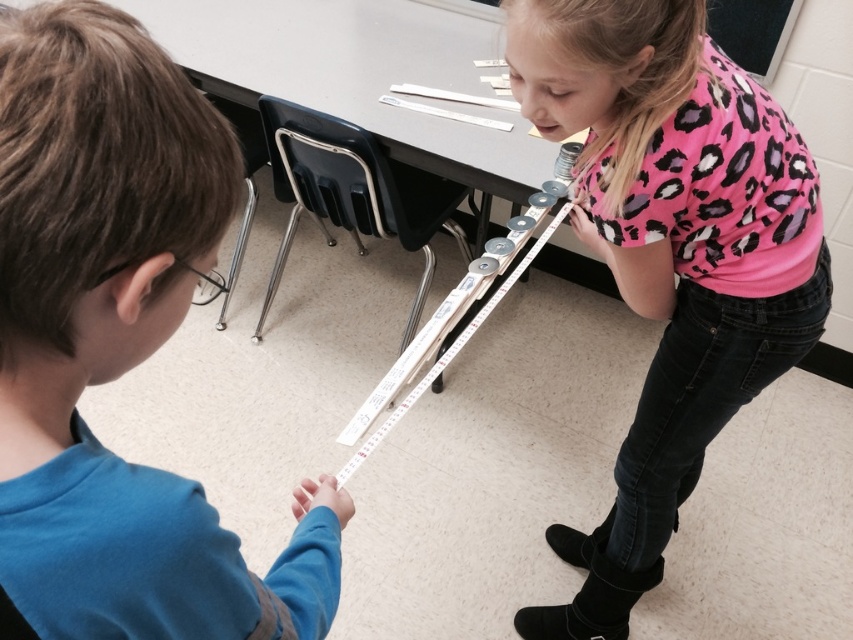
Which is behind, point (184, 112) or point (589, 627)?

Positioned behind is point (589, 627).

Is point (137, 488) farther from camera compared to point (753, 209)?

No, (137, 488) is in front of (753, 209).

Is point (64, 624) positioned in front of point (540, 618)?

Yes, point (64, 624) is closer to viewer.

Identify the location of blue fabric shirt at lower left. (119, 346).